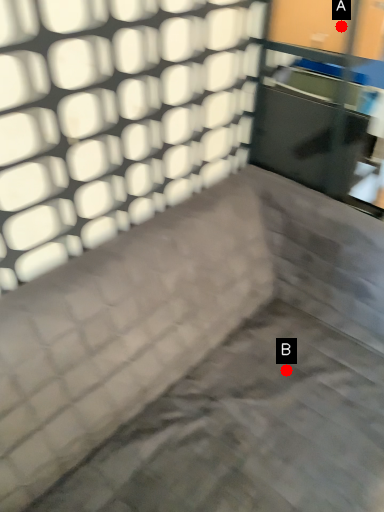
Question: Two points are circled on the image, labeled by A and B beside each circle. Which point is closer to the camera?

Choices:
 (A) A is closer
 (B) B is closer

Answer: (A)